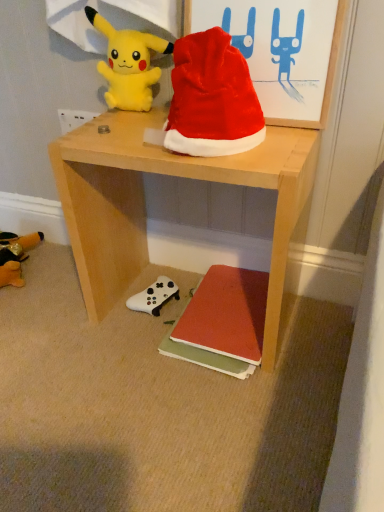
Where is `free region on the left part of red matte book at lower center`? This screenshot has width=384, height=512. free region on the left part of red matte book at lower center is located at coordinates (125, 342).